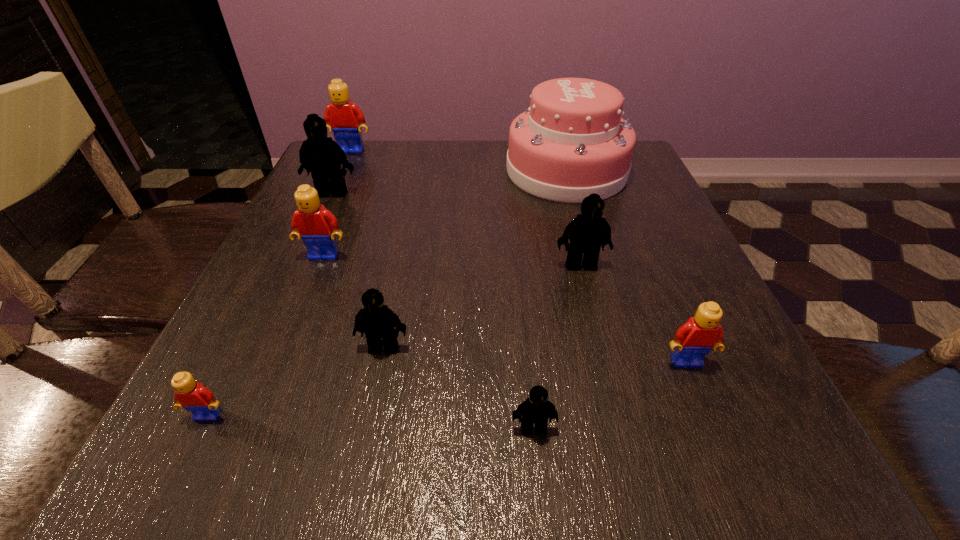
Locate an element on the screen. Image resolution: width=960 pixels, height=540 pixels. vacant space at the right edge is located at coordinates (650, 232).

In the image, there is a desktop. At what (x,y) coordinates should I click in order to perform the action: click on vacant space at the far left corner. Please return your answer as a coordinate pair (x, y). Looking at the image, I should click on (384, 146).

Find the location of a particular element. The image size is (960, 540). vacant region at the near left corner is located at coordinates (281, 442).

The image size is (960, 540). I want to click on free space at the near right corner, so click(768, 421).

Identify the location of free space that is in between the rightmost black Lego and the second black Lego from left to right. 482,306.

At what (x,y) coordinates should I click in order to perform the action: click on vacant point located between the second farthest yellow Lego and the farthest yellow Lego. Please return your answer as a coordinate pair (x, y). The width and height of the screenshot is (960, 540). Looking at the image, I should click on (338, 204).

In order to click on vacant space that is in between the smallest black Lego and the second farthest yellow Lego in this screenshot , I will do `click(429, 342)`.

Locate an element on the screen. vacant area between the nearest black Lego and the smallest yellow Lego is located at coordinates (372, 422).

Find the location of a particular element. This screenshot has width=960, height=540. free space between the farthest black Lego and the third nearest black Lego is located at coordinates (457, 229).

Locate an element on the screen. Image resolution: width=960 pixels, height=540 pixels. blank region between the leftmost black Lego and the nearest yellow Lego is located at coordinates (271, 304).